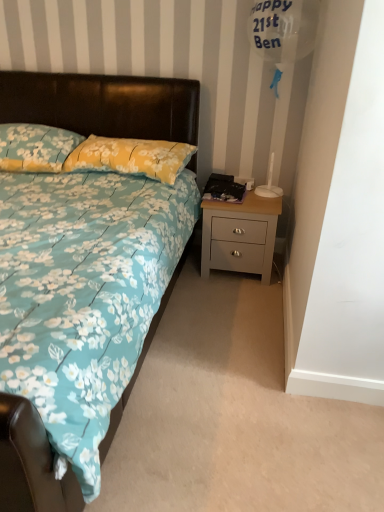
Question: Is yellow floral fabric pillow at center, the first pillow viewed from the right, a part of floral fabric bed at center?

Choices:
 (A) no
 (B) yes

Answer: (B)

Question: From the image's perspective, is floral fabric bed at center on top of yellow floral fabric pillow at center, marked as the 2th pillow in a left-to-right arrangement?

Choices:
 (A) no
 (B) yes

Answer: (A)

Question: Does floral fabric bed at center have a greater height compared to yellow floral fabric pillow at center, the first pillow viewed from the right?

Choices:
 (A) yes
 (B) no

Answer: (A)

Question: Could you tell me if floral fabric bed at center is facing yellow floral fabric pillow at center, marked as the 2th pillow in a left-to-right arrangement?

Choices:
 (A) yes
 (B) no

Answer: (B)

Question: From a real-world perspective, is floral fabric bed at center physically below yellow floral fabric pillow at center, marked as the 2th pillow in a left-to-right arrangement?

Choices:
 (A) yes
 (B) no

Answer: (A)

Question: In the image, is floral fabric pillow at upper left, arranged as the first pillow when viewed from the left, positioned in front of or behind light gray wood nightstand at lower right?

Choices:
 (A) front
 (B) behind

Answer: (A)

Question: Is point (9, 147) closer or farther from the camera than point (261, 273)?

Choices:
 (A) farther
 (B) closer

Answer: (B)

Question: Looking at their shapes, would you say floral fabric pillow at upper left, the 2th pillow positioned from the right, is wider or thinner than light gray wood nightstand at lower right?

Choices:
 (A) wide
 (B) thin

Answer: (A)

Question: From a real-world perspective, is floral fabric pillow at upper left, the 2th pillow positioned from the right, above or below light gray wood nightstand at lower right?

Choices:
 (A) above
 (B) below

Answer: (A)

Question: From the image's perspective, is floral fabric bed at center positioned above or below floral fabric pillow at upper left, the 2th pillow positioned from the right?

Choices:
 (A) above
 (B) below

Answer: (B)

Question: Considering the positions of floral fabric bed at center and floral fabric pillow at upper left, arranged as the first pillow when viewed from the left, in the image, is floral fabric bed at center bigger or smaller than floral fabric pillow at upper left, arranged as the first pillow when viewed from the left,?

Choices:
 (A) big
 (B) small

Answer: (A)

Question: Does point (162, 133) appear closer or farther from the camera than point (71, 141)?

Choices:
 (A) farther
 (B) closer

Answer: (A)

Question: In terms of width, does floral fabric bed at center look wider or thinner when compared to floral fabric pillow at upper left, the 2th pillow positioned from the right?

Choices:
 (A) thin
 (B) wide

Answer: (B)

Question: From the image's perspective, is floral fabric pillow at upper left, arranged as the first pillow when viewed from the left, positioned above or below yellow floral fabric pillow at center, the first pillow viewed from the right?

Choices:
 (A) above
 (B) below

Answer: (A)

Question: From a real-world perspective, relative to yellow floral fabric pillow at center, marked as the 2th pillow in a left-to-right arrangement, is floral fabric pillow at upper left, the 2th pillow positioned from the right, vertically above or below?

Choices:
 (A) below
 (B) above

Answer: (A)